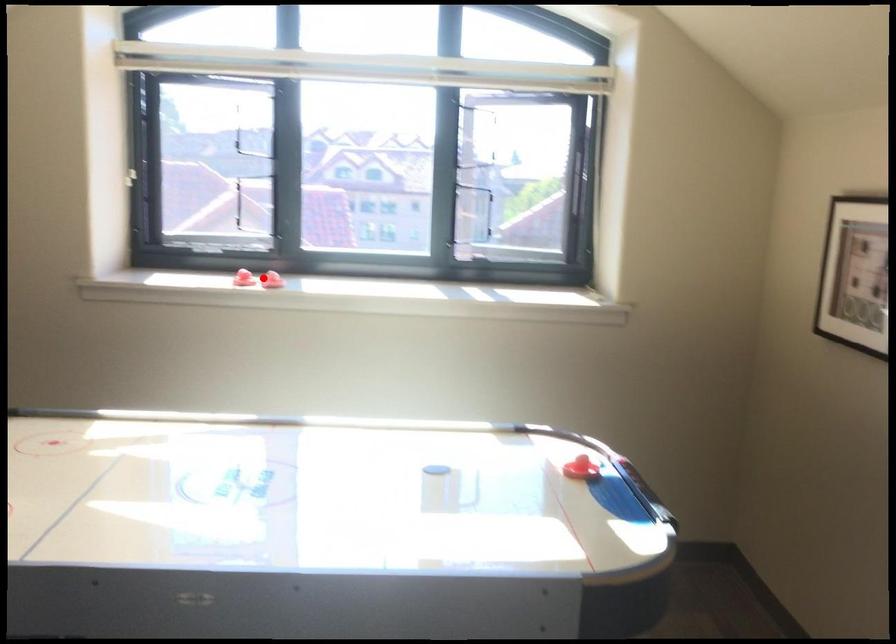
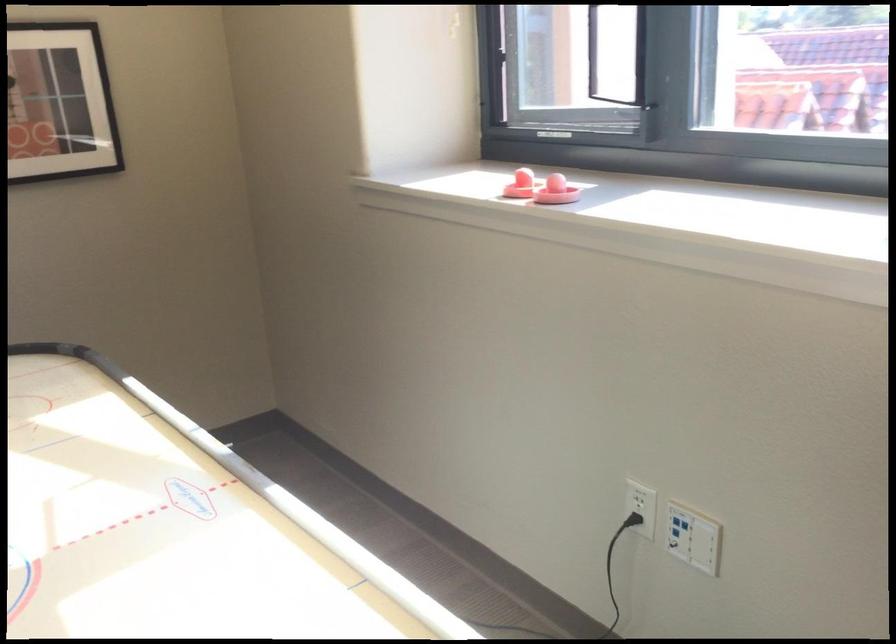
Question: I am providing you with two images of the same scene from different viewpoints. In image1, a red point is highlighted. Considering the same 3D point in image2, which of the following is correct?

Choices:
 (A) It is closer
 (B) It is farther

Answer: (A)